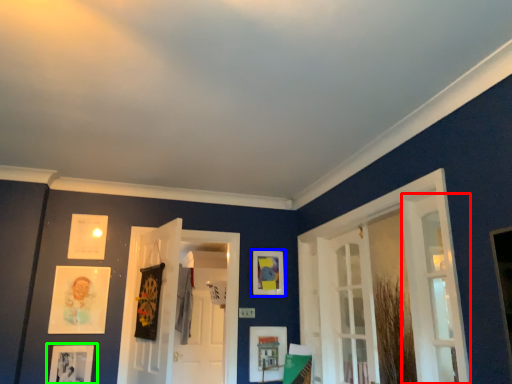
Question: Which object is the closest to the door (highlighted by a red box)? Choose among these: picture frame (highlighted by a blue box) or picture frame (highlighted by a green box).

Choices:
 (A) picture frame
 (B) picture frame

Answer: (A)